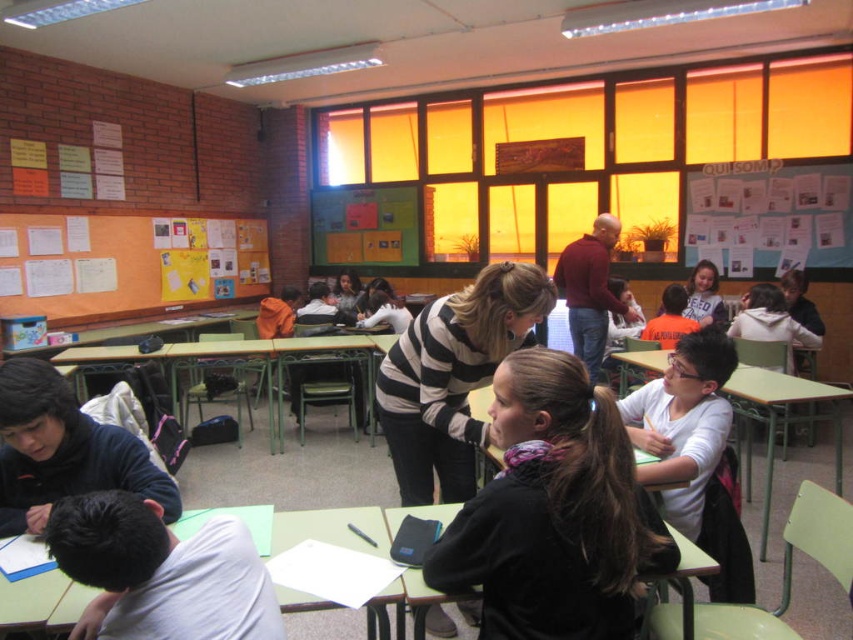
You are a student sitting at the green matte table at lower left and want to hand your homework to the teacher wearing the matte orange shirt at center. Can you reach the teacher directly from your seat without moving around the table?

The green matte table at lower left is closer to the viewer than the matte orange shirt at center, so you can reach the teacher directly from your seat without moving around the table because the table is in front of you and the teacher is further away but within reach.

Looking at this image, you are a student who needs to place a large project board between the green matte table at lower left and the green plastic table at center. Can you fit it there?

The green matte table at lower left is positioned on the right side of green plastic table at center, so there is no space between them to place the large project board.

You are a student who needs to place a 1.5 meter wide project board on either the green matte table at lower left or the matte orange shirt at center. Based on their widths, which object can accommodate the project board?

The matte orange shirt at center has a greater width than the green matte table at lower left, so the project board can be placed on the matte orange shirt at center.